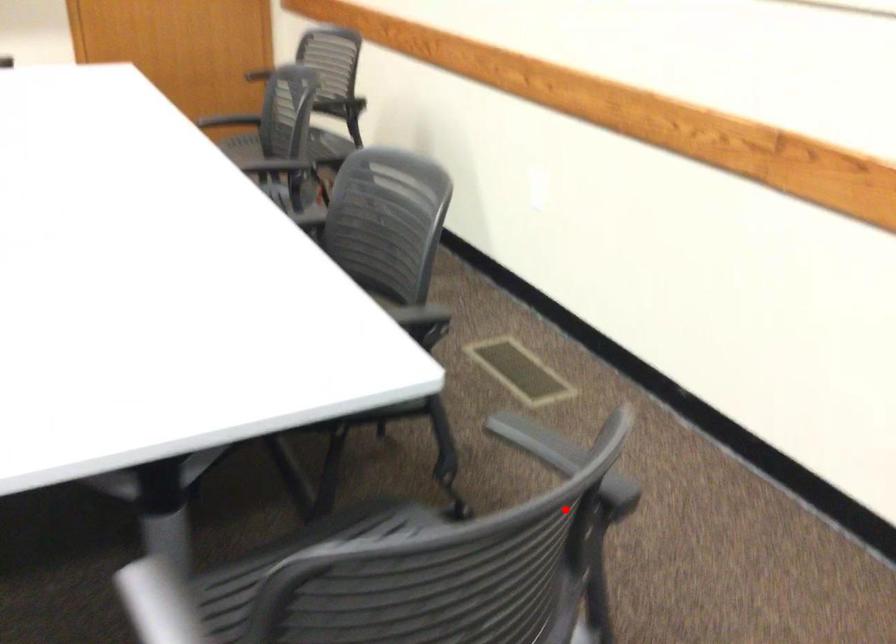
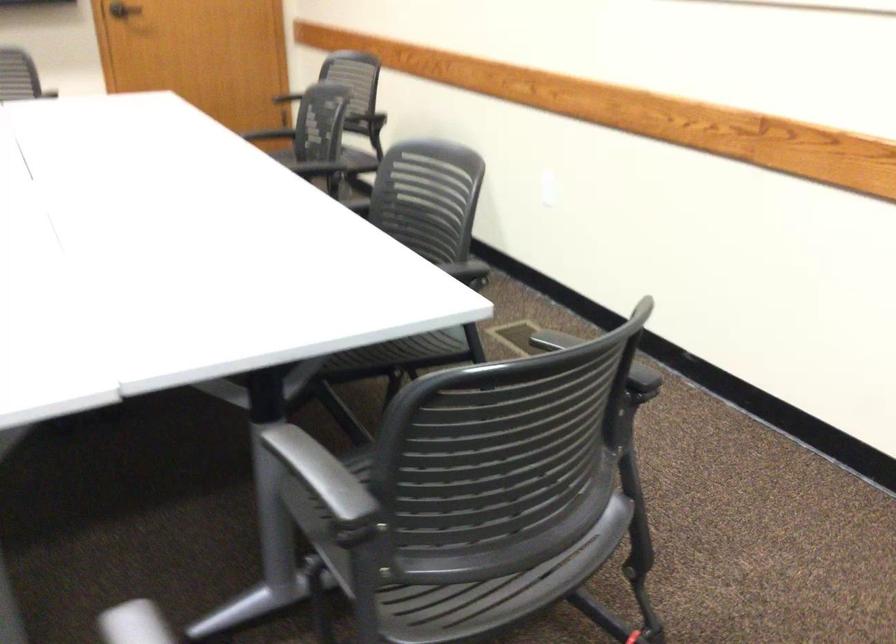
Question: I am providing you with two images of the same scene from different viewpoints. In image1, a red point is highlighted. Considering the same 3D point in image2, which of the following is correct?

Choices:
 (A) It is closer
 (B) It is farther

Answer: (B)